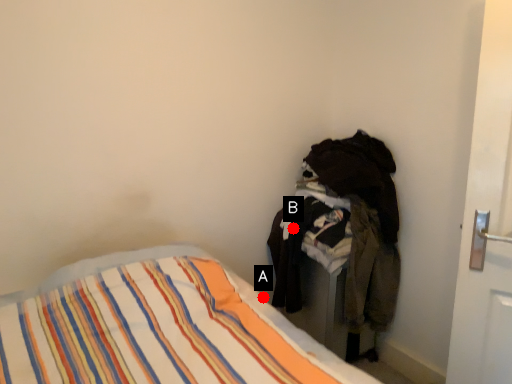
Question: Two points are circled on the image, labeled by A and B beside each circle. Which of the following is the farthest from the observer?

Choices:
 (A) A is further
 (B) B is further

Answer: (A)